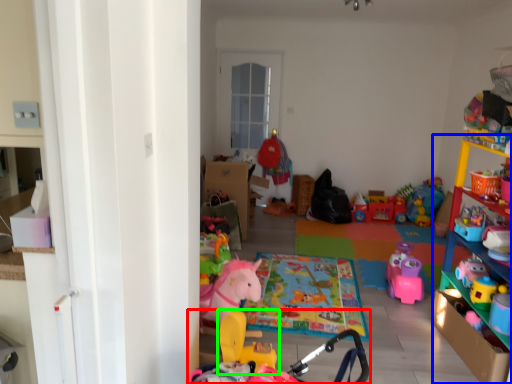
Question: Which object is positioned closest to toy (highlighted by a red box)? Select from shelf (highlighted by a blue box) and toy (highlighted by a green box).

Choices:
 (A) shelf
 (B) toy

Answer: (B)